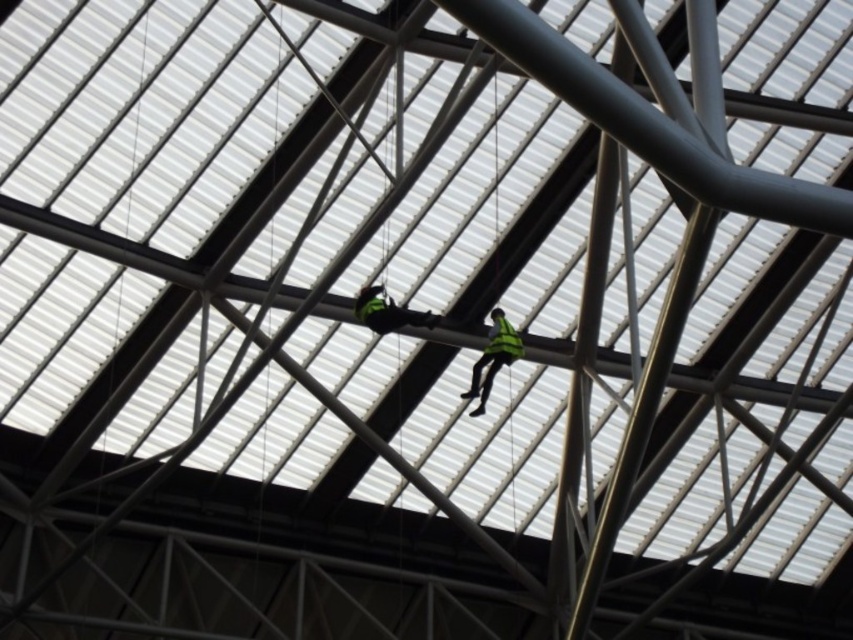
You are an inspector assessing the safety of the structure. You notice two workers wearing green reflective vest at upper center and green matte safety vest at center. Which worker is positioned higher up in the structure?

The green reflective vest at upper center is positioned higher up in the structure compared to the green matte safety vest at center.

You are a safety inspector in the large structure. You notice two points marked on the beams where workers are anchored. The points are labeled as point 1 at coordinates point (357, 305) and point 2 at coordinates point (494, 344). From your vantage point, which point is closer to you?

Point (357, 305) is in front of point (494, 344), so point 1 is closer to you.